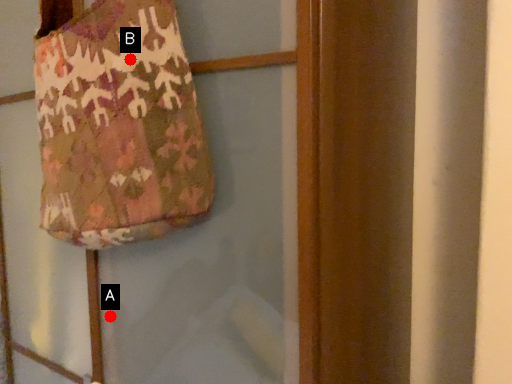
Question: Two points are circled on the image, labeled by A and B beside each circle. Which point appears farthest from the camera in this image?

Choices:
 (A) A is further
 (B) B is further

Answer: (A)